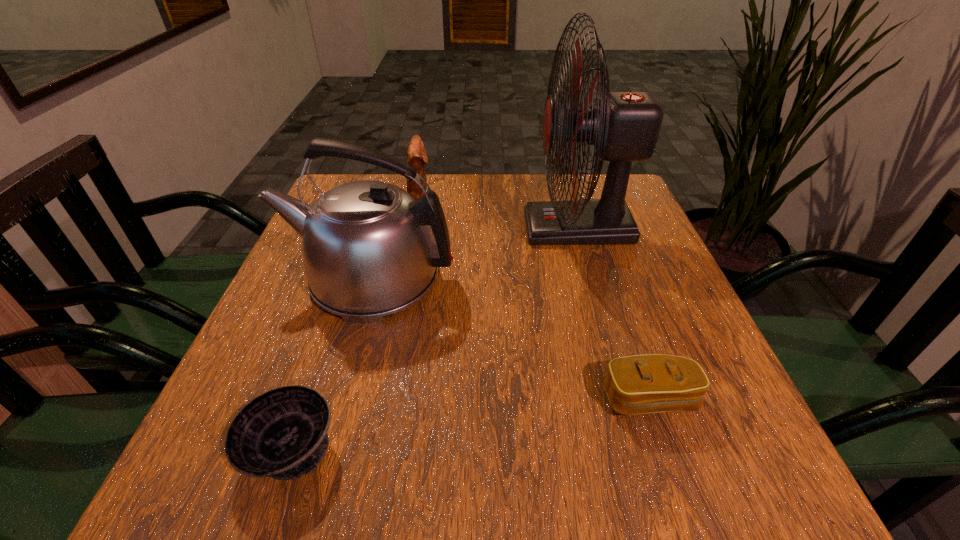
This screenshot has height=540, width=960. I want to click on vacant space that's between the bowl and the fourth shortest object, so click(x=331, y=363).

At what (x,y) coordinates should I click in order to perform the action: click on vacant space that is in between the fan and the bowl. Please return your answer as a coordinate pair (x, y). The image size is (960, 540). Looking at the image, I should click on (435, 339).

Where is `free space between the bowl and the nearer clutch bag`? This screenshot has width=960, height=540. free space between the bowl and the nearer clutch bag is located at coordinates (470, 424).

Where is `vacant space that's between the kettle and the tallest object`? The width and height of the screenshot is (960, 540). vacant space that's between the kettle and the tallest object is located at coordinates (474, 253).

You are a GUI agent. You are given a task and a screenshot of the screen. Output one action in this format:
    pyautogui.click(x=<x>, y=<y>)
    Task: Click on the free space that is in between the second tallest object and the shorter clutch bag
    
    Given the screenshot: What is the action you would take?
    pyautogui.click(x=511, y=338)

The image size is (960, 540). I want to click on the fourth closest object to the kettle, so click(x=640, y=384).

What are the coordinates of `object identified as the second closest to the bowl` in the screenshot? It's located at pyautogui.click(x=640, y=384).

Identify the location of free space that satisfies the following two spatial constraints: 1. on the spout of the fourth shortest object; 2. on the front side of the bowl. This screenshot has height=540, width=960. (323, 450).